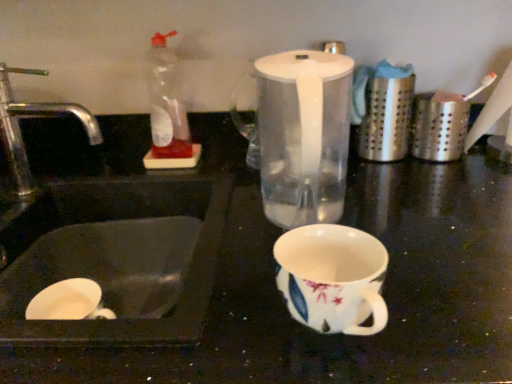
Question: Can you confirm if silver metallic faucet at left is shorter than transparent plastic blender at center?

Choices:
 (A) yes
 (B) no

Answer: (A)

Question: Considering the relative sizes of silver metallic faucet at left and transparent plastic blender at center in the image provided, is silver metallic faucet at left bigger than transparent plastic blender at center?

Choices:
 (A) no
 (B) yes

Answer: (A)

Question: From a real-world perspective, is silver metallic faucet at left positioned under transparent plastic blender at center based on gravity?

Choices:
 (A) yes
 (B) no

Answer: (A)

Question: Is silver metallic faucet at left positioned in front of transparent plastic blender at center?

Choices:
 (A) no
 (B) yes

Answer: (A)

Question: Is silver metallic faucet at left turned away from transparent plastic blender at center?

Choices:
 (A) yes
 (B) no

Answer: (B)

Question: Does silver metallic faucet at left have a smaller size compared to transparent plastic blender at center?

Choices:
 (A) yes
 (B) no

Answer: (A)

Question: Can you confirm if white glossy sink at lower left is thinner than silver metallic faucet at left?

Choices:
 (A) no
 (B) yes

Answer: (A)

Question: Can you confirm if white glossy sink at lower left is positioned to the left of silver metallic faucet at left?

Choices:
 (A) no
 (B) yes

Answer: (A)

Question: From a real-world perspective, is white glossy sink at lower left over silver metallic faucet at left?

Choices:
 (A) no
 (B) yes

Answer: (A)

Question: Is white glossy sink at lower left bigger than silver metallic faucet at left?

Choices:
 (A) no
 (B) yes

Answer: (B)

Question: Does white glossy sink at lower left have a greater height compared to silver metallic faucet at left?

Choices:
 (A) no
 (B) yes

Answer: (A)

Question: Considering the relative sizes of white glossy sink at lower left and silver metallic faucet at left in the image provided, is white glossy sink at lower left smaller than silver metallic faucet at left?

Choices:
 (A) yes
 (B) no

Answer: (B)

Question: Is transparent plastic blender at center closer to the viewer compared to silver metallic faucet at left?

Choices:
 (A) yes
 (B) no

Answer: (A)